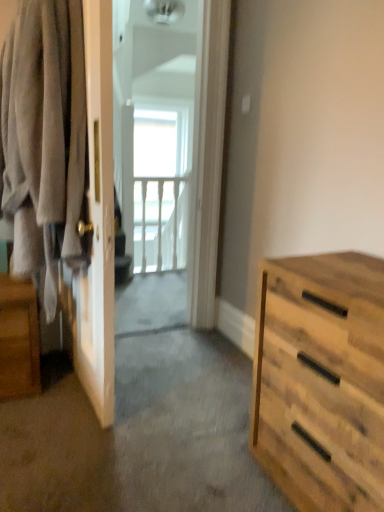
Question: From their relative heights in the image, would you say soft gray fabric at left is taller or shorter than wooden nightstand at left?

Choices:
 (A) short
 (B) tall

Answer: (B)

Question: From the image's perspective, relative to wooden nightstand at left, is soft gray fabric at left above or below?

Choices:
 (A) above
 (B) below

Answer: (A)

Question: Estimate the real-world distances between objects in this image. Which object is farther from the white wooden balustrade at upper center?

Choices:
 (A) natural wood dresser at right
 (B) white glossy screen door at center
 (C) wooden nightstand at left
 (D) soft gray fabric at left

Answer: (A)

Question: Which object is the closest to the soft gray fabric at left?

Choices:
 (A) white glossy screen door at center
 (B) wooden nightstand at left
 (C) natural wood dresser at right
 (D) white wooden balustrade at upper center

Answer: (B)